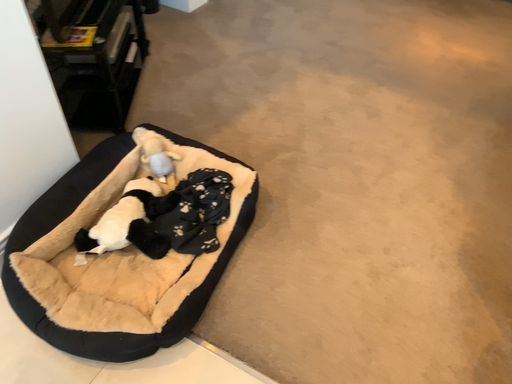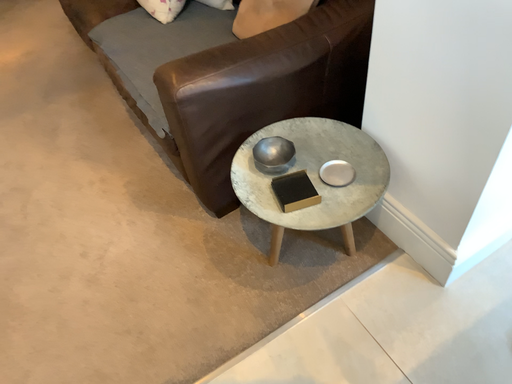
Question: Which way did the camera rotate in the video?

Choices:
 (A) rotated upward
 (B) rotated downward

Answer: (A)